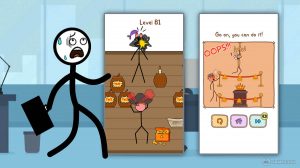
The image size is (300, 168). I want to click on trashcan, so click(x=31, y=145).